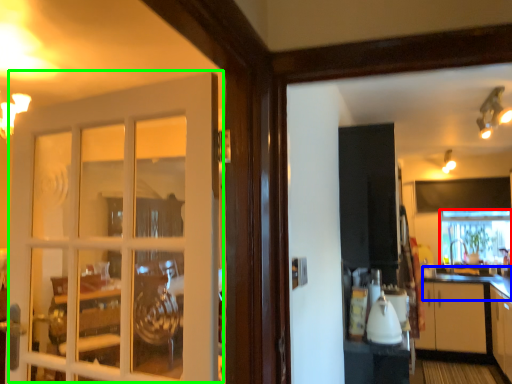
Question: Considering the real-world distances, which object is farthest from window frame (highlighted by a red box)? counter top (highlighted by a blue box) or door (highlighted by a green box)?

Choices:
 (A) counter top
 (B) door

Answer: (B)